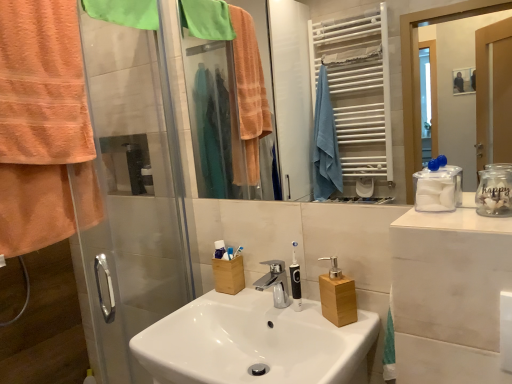
Describe the element at coordinates (42, 127) in the screenshot. I see `orange terry cloth towel at left, the 1th towel/napkin when ordered from bottom to top` at that location.

Describe the element at coordinates (238, 251) in the screenshot. I see `white plastic toothbrush at center, which is counted as the second toothbrush, starting from the left` at that location.

Where is `transparent glass shower door at left`? The image size is (512, 384). transparent glass shower door at left is located at coordinates (134, 193).

Describe the element at coordinates (134, 193) in the screenshot. I see `transparent glass shower door at left` at that location.

What is the approximate width of matte plastic toothbrushes at center?

It is 3.27 centimeters.

This screenshot has width=512, height=384. What are the coordinates of `white glossy mirror at upper center` in the screenshot? It's located at (389, 59).

Are white plastic toothbrush at center, which is the second toothbrush in right-to-left order, and matte plastic toothbrushes at center beside each other?

Yes.

Which of these two, white plastic toothbrush at center, positioned as the first toothbrush in left-to-right order, or matte plastic toothbrushes at center, stands shorter?

white plastic toothbrush at center, positioned as the first toothbrush in left-to-right order.

Can you confirm if white plastic toothbrush at center, positioned as the first toothbrush in left-to-right order, is thinner than matte plastic toothbrushes at center?

Yes, white plastic toothbrush at center, positioned as the first toothbrush in left-to-right order, is thinner than matte plastic toothbrushes at center.

From the image's perspective, is white plastic toothbrush at center, which is the second toothbrush in right-to-left order, on top of matte plastic toothbrushes at center?

No, from the image's perspective, white plastic toothbrush at center, which is the second toothbrush in right-to-left order, is not above matte plastic toothbrushes at center.

Between transparent plastic container at right and transparent glass shower door at left, which one has less height?

With less height is transparent plastic container at right.

From the image's perspective, relative to transparent glass shower door at left, is transparent plastic container at right above or below?

Clearly, from the image's perspective, transparent plastic container at right is above transparent glass shower door at left.

Is transparent plastic container at right smaller than transparent glass shower door at left?

Correct, transparent plastic container at right occupies less space than transparent glass shower door at left.

Is point (216, 256) closer or farther from the camera than point (334, 271)?

Point (216, 256) is farther from the camera than point (334, 271).

Would you consider matte plastic toothbrushes at center to be distant from wooden soap dispenser at center, the second bottle in the top-to-bottom sequence?

No, matte plastic toothbrushes at center is in close proximity to wooden soap dispenser at center, the second bottle in the top-to-bottom sequence.

Considering the sizes of objects matte plastic toothbrushes at center and wooden soap dispenser at center, the 1th bottle positioned from the back, in the image provided, who is bigger, matte plastic toothbrushes at center or wooden soap dispenser at center, the 1th bottle positioned from the back,?

wooden soap dispenser at center, the 1th bottle positioned from the back.

Is matte plastic toothbrushes at center located outside wooden soap dispenser at center, the 1th bottle positioned from the back?

Yes, matte plastic toothbrushes at center is outside of wooden soap dispenser at center, the 1th bottle positioned from the back.

Based on their sizes in the image, would you say white ceramic sink at center is bigger or smaller than green fabric towel at upper left, placed as the first towel/napkin when sorted from top to bottom?

Considering their sizes, white ceramic sink at center takes up more space than green fabric towel at upper left, placed as the first towel/napkin when sorted from top to bottom.

Is white ceramic sink at center placed right next to green fabric towel at upper left, placed as the first towel/napkin when sorted from top to bottom?

white ceramic sink at center is not next to green fabric towel at upper left, placed as the first towel/napkin when sorted from top to bottom, and they're not touching.

Which object is wider, white ceramic sink at center or green fabric towel at upper left, the 2th towel/napkin ordered from the bottom?

white ceramic sink at center is wider.

Identify the location of towel/napkin that is the 2nd object located above the white ceramic sink at center (from the image's perspective). The image size is (512, 384). (124, 12).

Looking at this image, which object is further away from the camera taking this photo, matte plastic toothbrushes at center or clear glass jar at right, the first bottle viewed from the front?

matte plastic toothbrushes at center.

Is point (217, 252) farther from viewer compared to point (489, 215)?

Yes, it is behind point (489, 215).

From a real-world perspective, between matte plastic toothbrushes at center and clear glass jar at right, placed as the first bottle when sorted from top to bottom, who is vertically higher?

clear glass jar at right, placed as the first bottle when sorted from top to bottom, from a real-world perspective.

Is clear glass jar at right, the first bottle viewed from the front, located within matte plastic toothbrushes at center?

That's incorrect, clear glass jar at right, the first bottle viewed from the front, is not inside matte plastic toothbrushes at center.

Does transparent plastic container at right turn towards white ceramic sink at center?

No, transparent plastic container at right is not oriented towards white ceramic sink at center.

From a real-world perspective, is transparent plastic container at right beneath white ceramic sink at center?

Incorrect, from a real-world perspective, transparent plastic container at right is higher than white ceramic sink at center.

From the image's perspective, is transparent plastic container at right on top of white ceramic sink at center?

Yes, from the image's perspective, transparent plastic container at right is above white ceramic sink at center.

Does transparent plastic container at right appear on the right side of white ceramic sink at center?

Indeed, transparent plastic container at right is positioned on the right side of white ceramic sink at center.

Does point (494, 185) appear closer or farther from the camera than point (2, 88)?

Point (494, 185).

Is clear glass jar at right, placed as the first bottle when sorted from top to bottom, located outside orange terry cloth towel at left, the 1th towel/napkin when ordered from bottom to top?

Yes.

Considering the sizes of objects clear glass jar at right, placed as the first bottle when sorted from top to bottom, and orange terry cloth towel at left, the 1th towel/napkin when ordered from bottom to top, in the image provided, who is thinner, clear glass jar at right, placed as the first bottle when sorted from top to bottom, or orange terry cloth towel at left, the 1th towel/napkin when ordered from bottom to top,?

clear glass jar at right, placed as the first bottle when sorted from top to bottom, is thinner.

Where is `the 2nd toothbrush in front of the matte plastic toothbrushes at center`? The height and width of the screenshot is (384, 512). the 2nd toothbrush in front of the matte plastic toothbrushes at center is located at coordinates (230, 253).

This screenshot has width=512, height=384. I want to click on tissue behind the transparent glass shower door at left, so click(x=438, y=186).

Based on their spatial positions, is matte plastic toothbrushes at center or orange terry cloth towel at left, the 1th towel/napkin when ordered from bottom to top, closer to transparent plastic container at right?

Based on the image, matte plastic toothbrushes at center appears to be nearer to transparent plastic container at right.

Which object lies further to the anchor point transparent glass shower door at left, green fabric towel at upper left, placed as the first towel/napkin when sorted from top to bottom, or white plastic toothbrush at center, positioned as the first toothbrush in left-to-right order?

Among the two, white plastic toothbrush at center, positioned as the first toothbrush in left-to-right order, is located further to transparent glass shower door at left.

Considering their positions, is white ceramic sink at center positioned further to matte plastic toothbrushes at center than wooden soap dispenser at center, which ranks as the second bottle in front-to-back order?

The object further to matte plastic toothbrushes at center is wooden soap dispenser at center, which ranks as the second bottle in front-to-back order.

Estimate the real-world distances between objects in this image. Which object is closer to white plastic toothbrush at center, the 1th toothbrush from the right, white glossy mirror at upper center or clear glass jar at right, the first bottle viewed from the front?

clear glass jar at right, the first bottle viewed from the front, is positioned closer to the anchor white plastic toothbrush at center, the 1th toothbrush from the right.

Considering their positions, is orange terry cloth towel at left, the 1th towel/napkin when ordered from bottom to top, positioned further to transparent glass shower door at left than matte plastic toothbrushes at center?

Based on the image, matte plastic toothbrushes at center appears to be further to transparent glass shower door at left.

Looking at this image, when comparing their distances from green fabric towel at upper left, the 2th towel/napkin ordered from the bottom, does white glossy mirror at upper center or white ceramic sink at center seem further?

white glossy mirror at upper center.

Considering their positions, is orange terry cloth towel at left, the 1th towel/napkin when ordered from bottom to top, positioned closer to wooden soap dispenser at center, which ranks as the first bottle in bottom-to-top order, than matte plastic toothbrushes at center?

Based on the image, matte plastic toothbrushes at center appears to be nearer to wooden soap dispenser at center, which ranks as the first bottle in bottom-to-top order.

Estimate the real-world distances between objects in this image. Which object is further from white plastic toothbrush at center, which is the second toothbrush in right-to-left order, white plastic toothbrush at center, which is counted as the second toothbrush, starting from the left, or white ceramic sink at center?

white ceramic sink at center is further to white plastic toothbrush at center, which is the second toothbrush in right-to-left order.

Identify the location of towel/napkin between green fabric towel at upper left, placed as the first towel/napkin when sorted from top to bottom, and white plastic toothbrush at center, which is the second toothbrush in right-to-left order, vertically. This screenshot has height=384, width=512. (42, 127).

You are a GUI agent. You are given a task and a screenshot of the screen. Output one action in this format:
    pyautogui.click(x=<x>, y=<y>)
    Task: Click on the sink between transparent glass shower door at left and wooden soap dispenser at center, which ranks as the second bottle in front-to-back order
    
    Given the screenshot: What is the action you would take?
    pyautogui.click(x=253, y=342)

You are a GUI agent. You are given a task and a screenshot of the screen. Output one action in this format:
    pyautogui.click(x=<x>, y=<y>)
    Task: Click on the sink between orange terry cloth towel at left, the second towel/napkin viewed from the top, and white glossy mirror at upper center from left to right
    Image resolution: width=512 pixels, height=384 pixels.
    Given the screenshot: What is the action you would take?
    point(253,342)

Locate an element on the screen. The width and height of the screenshot is (512, 384). tissue between white glossy mirror at upper center and white plastic toothbrush at center, which is the second toothbrush in right-to-left order, in the front-back direction is located at coordinates (438, 186).